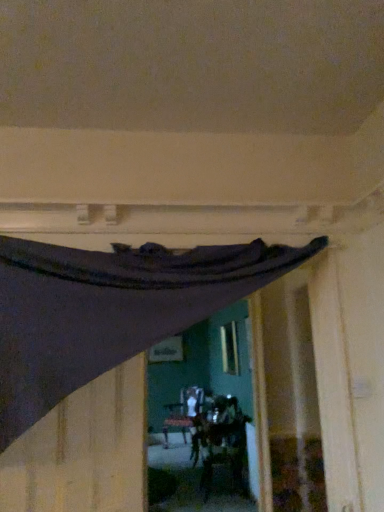
Question: Is dark matte fabric at upper left inside the boundaries of dark fabric curtain at upper center, or outside?

Choices:
 (A) inside
 (B) outside

Answer: (A)

Question: In terms of size, does dark matte fabric at upper left appear bigger or smaller than dark fabric curtain at upper center?

Choices:
 (A) big
 (B) small

Answer: (B)

Question: Is dark matte fabric at upper left taller or shorter than dark fabric curtain at upper center?

Choices:
 (A) short
 (B) tall

Answer: (A)

Question: From a real-world perspective, is dark fabric curtain at upper center positioned above or below dark matte fabric at upper left?

Choices:
 (A) below
 (B) above

Answer: (B)

Question: Would you say dark fabric curtain at upper center is to the left or to the right of dark matte fabric at upper left in the picture?

Choices:
 (A) left
 (B) right

Answer: (B)

Question: From the image's perspective, is dark fabric curtain at upper center positioned above or below dark matte fabric at upper left?

Choices:
 (A) below
 (B) above

Answer: (B)

Question: Considering the positions of dark fabric curtain at upper center and dark matte fabric at upper left in the image, is dark fabric curtain at upper center bigger or smaller than dark matte fabric at upper left?

Choices:
 (A) small
 (B) big

Answer: (B)